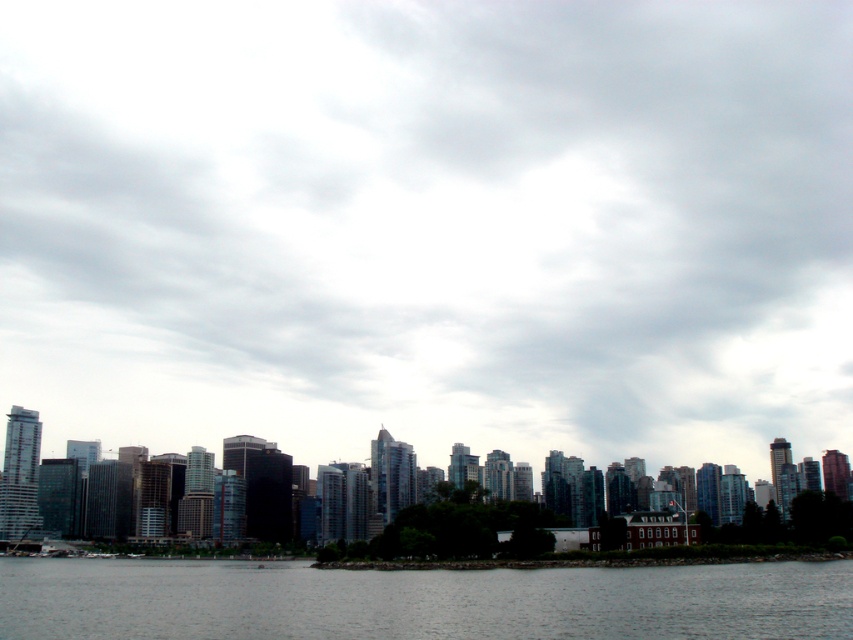
Does cloudy sky at upper center have a larger size compared to dark gray water at lower center?

A: Correct, cloudy sky at upper center is larger in size than dark gray water at lower center.

Does cloudy sky at upper center appear on the left side of dark gray water at lower center?

No, cloudy sky at upper center is not to the left of dark gray water at lower center.

Which is behind, point (93, 250) or point (792, 596)?

Positioned behind is point (93, 250).

Identify the location of cloudy sky at upper center. (428, 227).

Is point (457, 336) farther from camera compared to point (384, 538)?

Yes.

Measure the distance between cloudy sky at upper center and glassy skyscrapers at center.

cloudy sky at upper center and glassy skyscrapers at center are 188.31 meters apart from each other.

Measure the distance between cloudy sky at upper center and camera.

cloudy sky at upper center and camera are 976.16 feet apart.

Find the location of `cloudy sky at upper center`. cloudy sky at upper center is located at coordinates (428, 227).

Which is more to the left, dark gray water at lower center or glassy skyscrapers at center?

dark gray water at lower center is more to the left.

Is dark gray water at lower center smaller than glassy skyscrapers at center?

Yes.

Describe the element at coordinates (418, 600) in the screenshot. I see `dark gray water at lower center` at that location.

Image resolution: width=853 pixels, height=640 pixels. Find the location of `dark gray water at lower center`. dark gray water at lower center is located at coordinates coord(418,600).